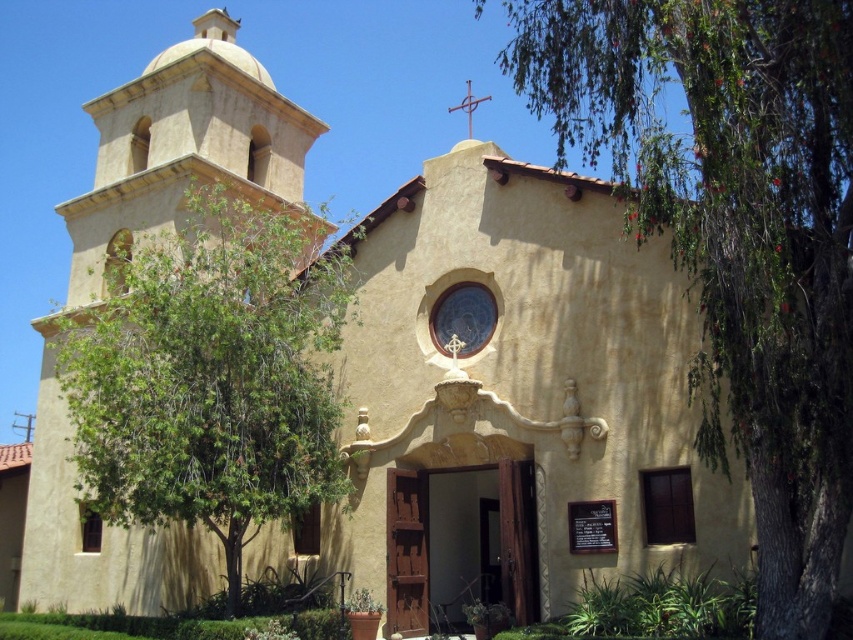
Does green leafy tree at right have a smaller size compared to green leafy tree at left?

Actually, green leafy tree at right might be larger than green leafy tree at left.

The image size is (853, 640). In order to click on green leafy tree at right in this screenshot , I will do `click(734, 234)`.